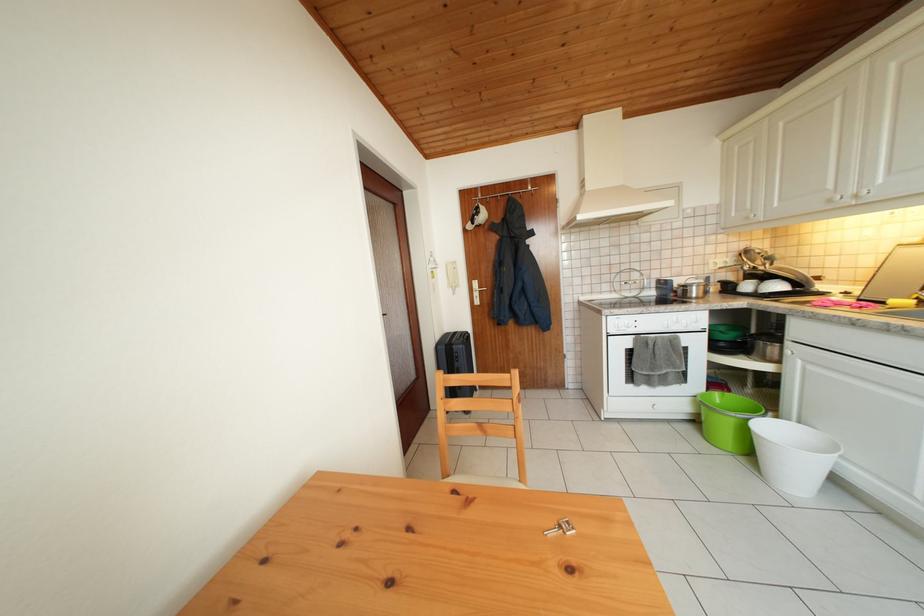
Find the location of a particular element. This screenshot has width=924, height=616. silver door handle is located at coordinates (476, 292).